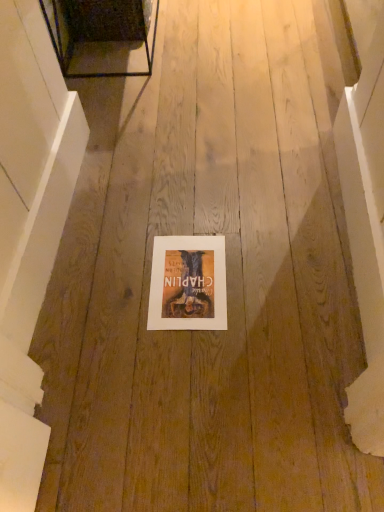
Measure the distance between matte paper picture frame at center and camera.

The distance of matte paper picture frame at center from camera is 1.09 meters.

Describe the element at coordinates (188, 284) in the screenshot. I see `matte paper picture frame at center` at that location.

Image resolution: width=384 pixels, height=512 pixels. In order to click on matte paper picture frame at center in this screenshot , I will do `click(188, 284)`.

Locate an element on the screen. Image resolution: width=384 pixels, height=512 pixels. matte paper picture frame at center is located at coordinates (188, 284).